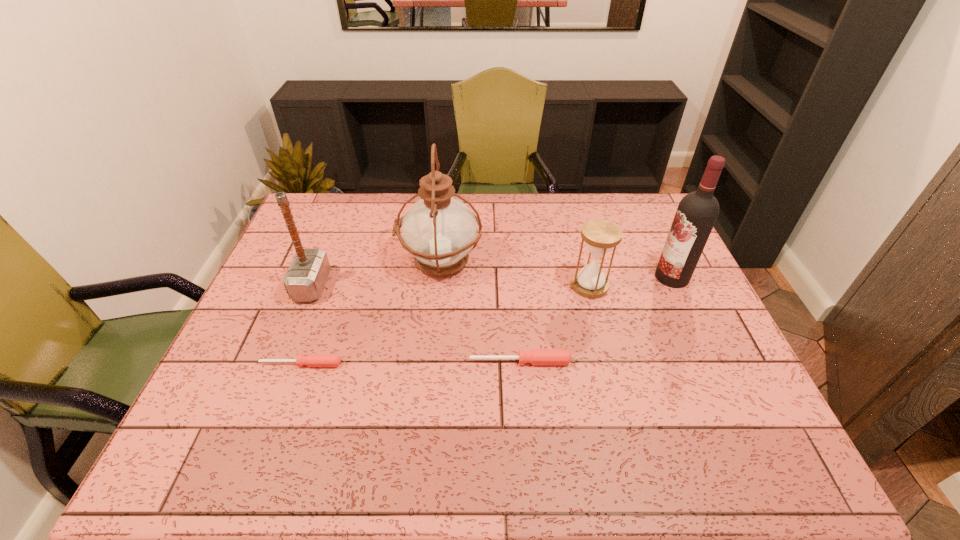
The screwdrivers are evenly distributed in the image. To maintain this, where would you place another screwdriver on the right? Please point to a free space. Please provide its 2D coordinates. Your answer should be formatted as a tuple, i.e. [(x, y)], where the tuple contains the x and y coordinates of a point satisfying the conditions above.

[(737, 359)]